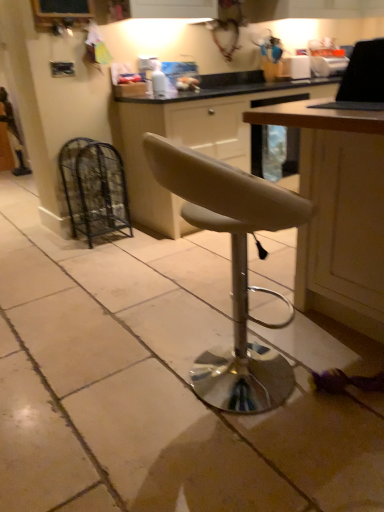
Locate an element on the screen. Image resolution: width=384 pixels, height=512 pixels. empty space that is in between beige leather stool at center and wooden table at right is located at coordinates (303, 418).